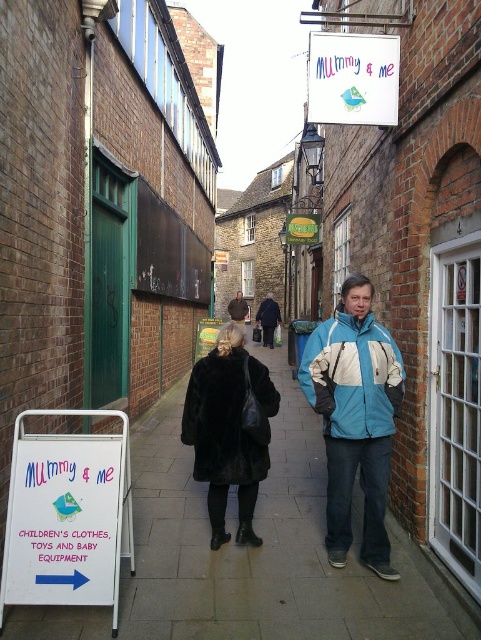
Which is more to the left, velvet black coat at center or dark brown leather jacket at center?

Positioned to the left is dark brown leather jacket at center.

Can you confirm if velvet black coat at center is positioned above dark brown leather jacket at center?

Actually, velvet black coat at center is below dark brown leather jacket at center.

This screenshot has width=481, height=640. What do you see at coordinates (354, 419) in the screenshot?
I see `velvet black coat at center` at bounding box center [354, 419].

Where is `velvet black coat at center`? Image resolution: width=481 pixels, height=640 pixels. velvet black coat at center is located at coordinates (354, 419).

Which is above, blue/white jacket at center or blue and white jacket at center?

Positioned higher is blue and white jacket at center.

Can you confirm if blue/white jacket at center is positioned below blue and white jacket at center?

Correct, blue/white jacket at center is located below blue and white jacket at center.

Is point (369, 324) less distant than point (342, 355)?

No, it is not.

The height and width of the screenshot is (640, 481). Identify the location of blue/white jacket at center. (354, 419).

Is point (263, 304) behind point (236, 316)?

No.

At what (x,y) coordinates should I click in order to perform the action: click on dark brown leather jacket at center. Please return your answer as a coordinate pair (x, y). The height and width of the screenshot is (640, 481). Looking at the image, I should click on [267, 317].